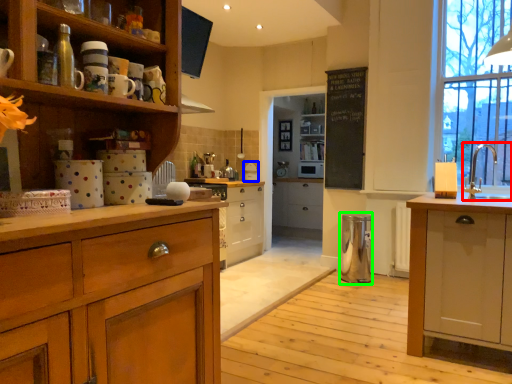
Question: Considering the real-world distances, which object is farthest from sink (highlighted by a red box)? appliance (highlighted by a blue box) or appliance (highlighted by a green box)?

Choices:
 (A) appliance
 (B) appliance

Answer: (A)